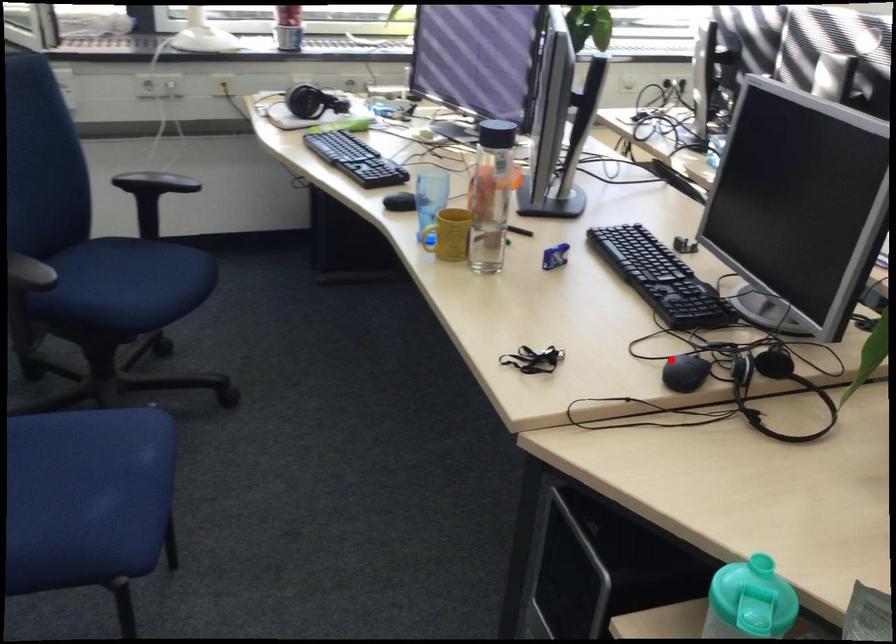
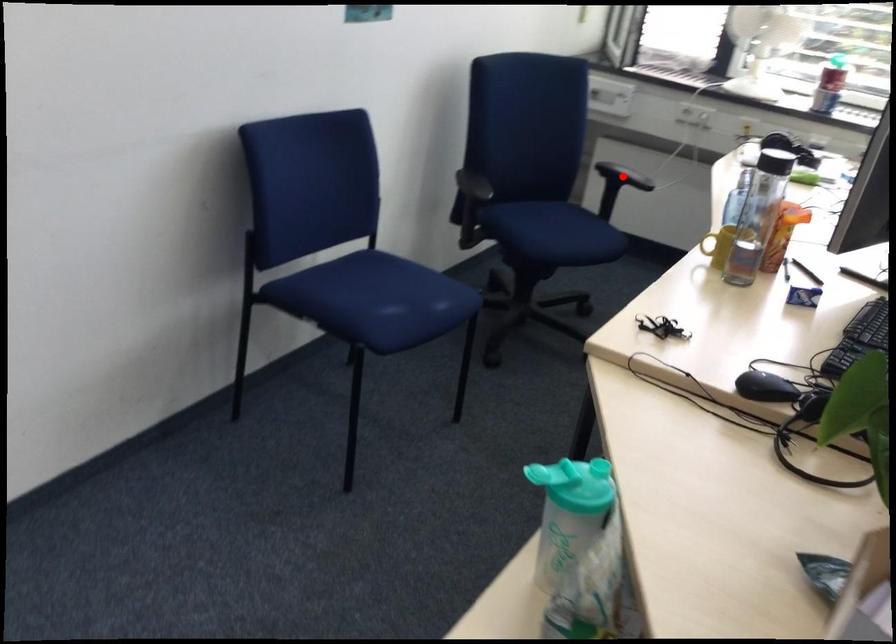
I am providing you with two images of the same scene from different viewpoints. A red point is marked on the first image and another point is marked on the second image. Do the highlighted points in image1 and image2 indicate the same real-world spot?

No